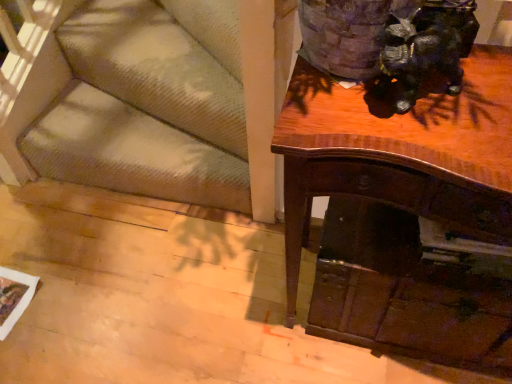
What is the approximate height of shiny brown desk at upper right?

It is 29.92 inches.

At what (x,y) coordinates should I click in order to perform the action: click on shiny brown desk at upper right. Please return your answer as a coordinate pair (x, y). This screenshot has height=384, width=512. Looking at the image, I should click on (402, 213).

The image size is (512, 384). What do you see at coordinates (426, 47) in the screenshot? I see `shiny black statue at upper right` at bounding box center [426, 47].

The height and width of the screenshot is (384, 512). Describe the element at coordinates (156, 101) in the screenshot. I see `textured beige carpet at lower left` at that location.

This screenshot has height=384, width=512. Find the location of `shiny brown desk at upper right`. shiny brown desk at upper right is located at coordinates (402, 213).

Is point (337, 257) closer or farther from the camera than point (443, 12)?

Point (337, 257).

Is shiny brown desk at upper right not within shiny black statue at upper right?

Indeed, shiny brown desk at upper right is completely outside shiny black statue at upper right.

Considering the relative positions of shiny brown desk at upper right and shiny black statue at upper right in the image provided, is shiny brown desk at upper right to the right of shiny black statue at upper right from the viewer's perspective?

Correct, you'll find shiny brown desk at upper right to the right of shiny black statue at upper right.

Based on their sizes in the image, would you say shiny brown desk at upper right is bigger or smaller than shiny black statue at upper right?

Clearly, shiny brown desk at upper right is larger in size than shiny black statue at upper right.

Is shiny black statue at upper right positioned beyond the bounds of shiny brown desk at upper right?

Yes, shiny black statue at upper right is outside of shiny brown desk at upper right.

Which object is positioned more to the left, shiny black statue at upper right or shiny brown desk at upper right?

shiny black statue at upper right.

Could you tell me if shiny black statue at upper right is facing shiny brown desk at upper right?

No, shiny black statue at upper right does not turn towards shiny brown desk at upper right.

From the image's perspective, would you say wooden drawer at lower right is positioned over shiny brown desk at upper right?

No, from the image's perspective, wooden drawer at lower right is not over shiny brown desk at upper right.

Is wooden drawer at lower right not within shiny brown desk at upper right?

Actually, wooden drawer at lower right is within shiny brown desk at upper right.

Can you confirm if wooden drawer at lower right is wider than shiny brown desk at upper right?

Indeed, wooden drawer at lower right has a greater width compared to shiny brown desk at upper right.

Is shiny brown desk at upper right positioned with its back to textured beige carpet at lower left?

No, shiny brown desk at upper right is not facing the opposite direction of textured beige carpet at lower left.

Is shiny brown desk at upper right completely or partially outside of textured beige carpet at lower left?

Yes.

In the image, is shiny brown desk at upper right positioned in front of or behind textured beige carpet at lower left?

Visually, shiny brown desk at upper right is located in front of textured beige carpet at lower left.

Does shiny brown desk at upper right have a greater width compared to textured beige carpet at lower left?

No.

Which is less distant, (178, 132) or (406, 48)?

The point (406, 48) is closer to the camera.

The height and width of the screenshot is (384, 512). What are the coordinates of `furniture below the shiny black statue at upper right (from the image's perspective)` in the screenshot? It's located at (156, 101).

Is textured beige carpet at lower left placed right next to shiny black statue at upper right?

No, textured beige carpet at lower left is not beside shiny black statue at upper right.

Consider the image. Considering the sizes of objects textured beige carpet at lower left and shiny black statue at upper right in the image provided, who is wider, textured beige carpet at lower left or shiny black statue at upper right?

textured beige carpet at lower left is wider.

From a real-world perspective, is textured beige carpet at lower left physically located above or below wooden drawer at lower right?

In terms of real-world spatial position, textured beige carpet at lower left is below wooden drawer at lower right.

The height and width of the screenshot is (384, 512). Identify the location of furniture that appears below the wooden drawer at lower right (from a real-world perspective). (156, 101).

Does textured beige carpet at lower left have a lesser width compared to wooden drawer at lower right?

No, textured beige carpet at lower left is not thinner than wooden drawer at lower right.

Is textured beige carpet at lower left in front of or behind wooden drawer at lower right in the image?

Visually, textured beige carpet at lower left is located behind wooden drawer at lower right.

Consider the image. Considering the sizes of shiny black statue at upper right and textured beige carpet at lower left in the image, is shiny black statue at upper right taller or shorter than textured beige carpet at lower left?

Clearly, shiny black statue at upper right is shorter compared to textured beige carpet at lower left.

Between shiny black statue at upper right and textured beige carpet at lower left, which one has smaller width?

With smaller width is shiny black statue at upper right.

Is shiny black statue at upper right positioned far away from textured beige carpet at lower left?

No, there isn't a large distance between shiny black statue at upper right and textured beige carpet at lower left.

Is textured beige carpet at lower left completely or partially inside shiny black statue at upper right?

Definitely not — textured beige carpet at lower left is not inside shiny black statue at upper right.

This screenshot has width=512, height=384. Identify the location of animal lying above the shiny brown desk at upper right (from the image's perspective). (426, 47).

What are the coordinates of `animal that is on the left side of shiny brown desk at upper right` in the screenshot? It's located at (426, 47).

Looking at the image, which one is located further to shiny brown desk at upper right, shiny black statue at upper right or textured beige carpet at lower left?

textured beige carpet at lower left.

Based on their spatial positions, is textured beige carpet at lower left or shiny brown desk at upper right closer to wooden drawer at lower right?

The object closer to wooden drawer at lower right is shiny brown desk at upper right.

Estimate the real-world distances between objects in this image. Which object is further from shiny brown desk at upper right, textured beige carpet at lower left or shiny black statue at upper right?

textured beige carpet at lower left is positioned further to the anchor shiny brown desk at upper right.

Based on their spatial positions, is wooden drawer at lower right or shiny black statue at upper right further from shiny brown desk at upper right?

shiny black statue at upper right is further to shiny brown desk at upper right.

Estimate the real-world distances between objects in this image. Which object is further from shiny brown desk at upper right, shiny black statue at upper right or wooden drawer at lower right?

Among the two, shiny black statue at upper right is located further to shiny brown desk at upper right.

From the picture: Estimate the real-world distances between objects in this image. Which object is further from wooden drawer at lower right, textured beige carpet at lower left or shiny black statue at upper right?

Among the two, textured beige carpet at lower left is located further to wooden drawer at lower right.

Based on their spatial positions, is textured beige carpet at lower left or wooden drawer at lower right further from shiny black statue at upper right?

The object further to shiny black statue at upper right is textured beige carpet at lower left.

Which object lies nearer to the anchor point wooden drawer at lower right, shiny brown desk at upper right or shiny black statue at upper right?

shiny brown desk at upper right lies closer to wooden drawer at lower right than the other object.

Find the location of a particular element. Image resolution: width=512 pixels, height=384 pixels. animal between shiny brown desk at upper right and textured beige carpet at lower left in the front-back direction is located at coordinates (426, 47).

At what (x,y) coordinates should I click in order to perform the action: click on animal located between textured beige carpet at lower left and wooden drawer at lower right in the left-right direction. Please return your answer as a coordinate pair (x, y). This screenshot has height=384, width=512. Looking at the image, I should click on (426, 47).

What are the coordinates of `desk situated between textured beige carpet at lower left and wooden drawer at lower right from left to right` in the screenshot? It's located at (402, 213).

Identify the location of desk between shiny black statue at upper right and wooden drawer at lower right in the vertical direction. The width and height of the screenshot is (512, 384). (402, 213).